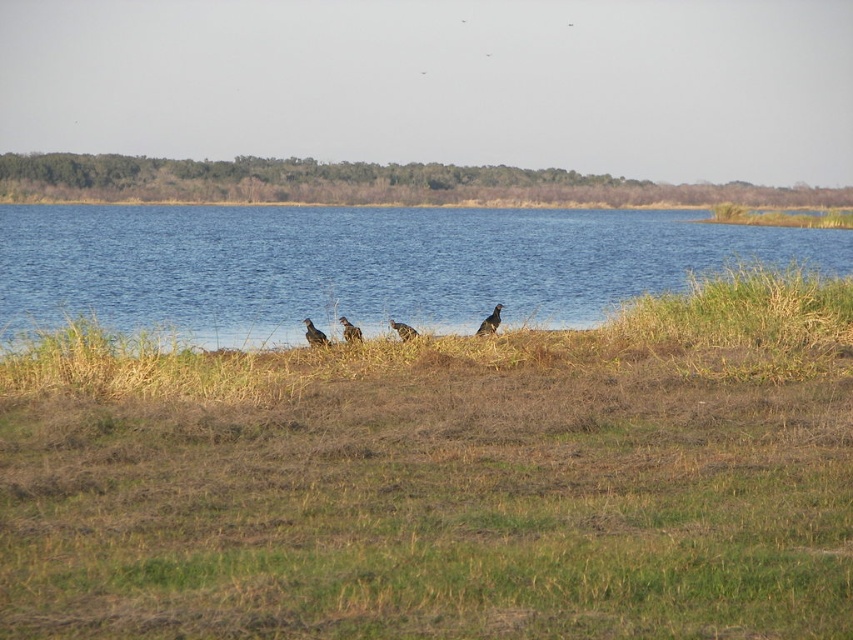
Question: Does dark gray feathers at center have a smaller size compared to gray feathered bird at center?

Choices:
 (A) no
 (B) yes

Answer: (B)

Question: Is brown dry grass at center wider than blue water at center?

Choices:
 (A) yes
 (B) no

Answer: (B)

Question: Which object appears closest to the camera in this image?

Choices:
 (A) brown speckled feathered bird at center
 (B) brown dry grass at center
 (C) blue water at center

Answer: (B)

Question: Based on their relative distances, which object is farther from the brown feathered bird at center?

Choices:
 (A) brown dry grass at center
 (B) dark gray feathers at center
 (C) gray feathered bird at center
 (D) blue water at center

Answer: (D)

Question: Is brown feathered bird at center below brown speckled feathered bird at center?

Choices:
 (A) no
 (B) yes

Answer: (A)

Question: Which object is the closest to the gray feathered bird at center?

Choices:
 (A) brown speckled feathered bird at center
 (B) brown dry grass at center
 (C) blue water at center
 (D) dark gray feathers at center

Answer: (D)